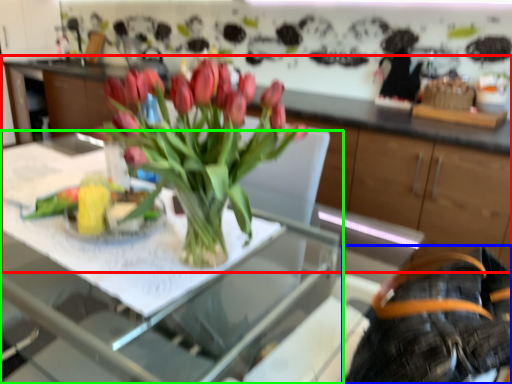
Question: Which object is positioned farthest from cabinetry (highlighted by a red box)? Select from back (highlighted by a blue box) and table (highlighted by a green box).

Choices:
 (A) back
 (B) table

Answer: (A)